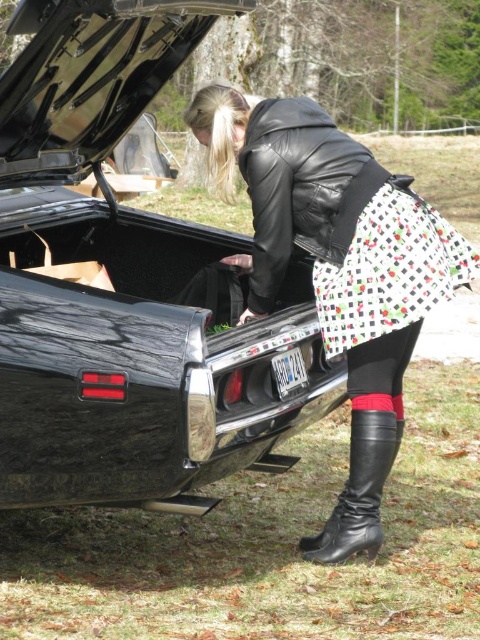
Question: Estimate the real-world distances between objects in this image. Which object is closer to the leather jacket at center?

Choices:
 (A) black leather boot at lower center
 (B) glossy black car at center

Answer: (A)

Question: Is printed cotton dress at center further to the viewer compared to black leather boot at lower center?

Choices:
 (A) yes
 (B) no

Answer: (B)

Question: Which point is closer to the camera taking this photo?

Choices:
 (A) (291, 224)
 (B) (444, 230)
 (C) (75, 344)

Answer: (C)

Question: Is leather jacket at center positioned behind printed cotton dress at center?

Choices:
 (A) yes
 (B) no

Answer: (A)

Question: Based on their relative distances, which object is nearer to the printed cotton skirt at center?

Choices:
 (A) printed cotton dress at center
 (B) leather jacket at center
 (C) glossy black car at center

Answer: (A)

Question: Can you confirm if printed cotton skirt at center is thinner than black leather boot at lower center?

Choices:
 (A) no
 (B) yes

Answer: (A)